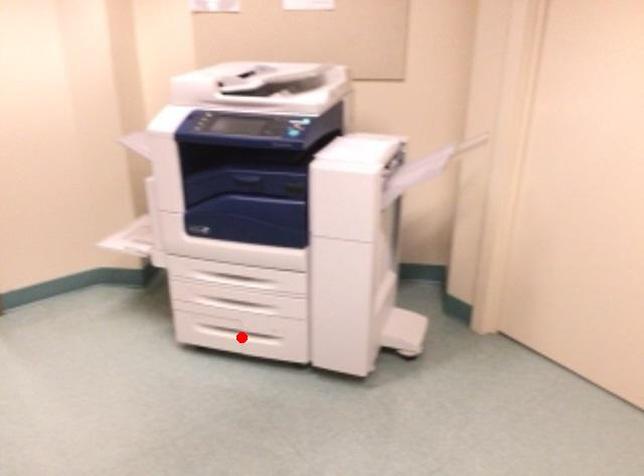
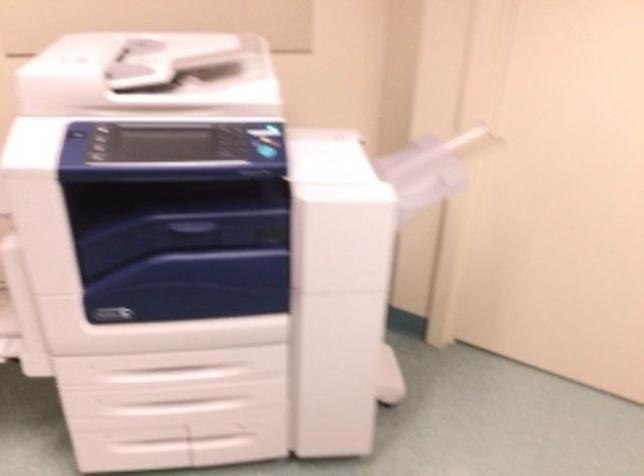
The point at the highlighted location is marked in the first image. Where is the corresponding point in the second image?

(183, 442)